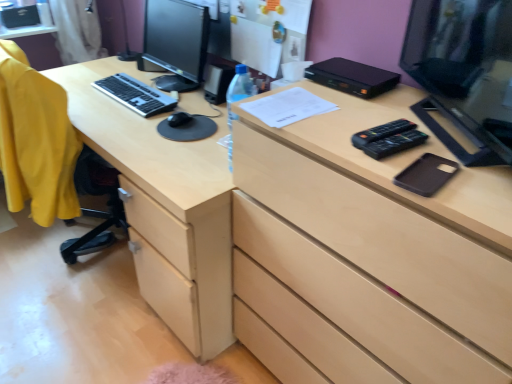
Locate an element on the screen. Image resolution: width=512 pixels, height=384 pixels. vacant area that is in front of black matte phone case at right is located at coordinates (465, 199).